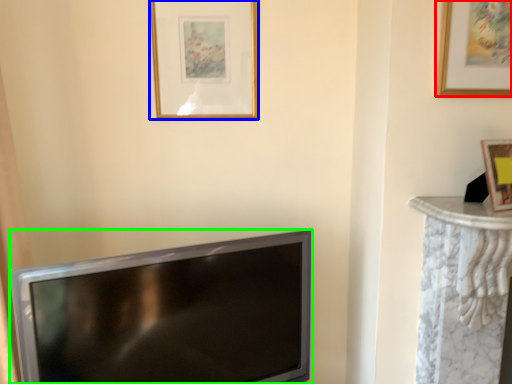
Question: Based on their relative distances, which object is nearer to picture frame (highlighted by a red box)? Choose from picture frame (highlighted by a blue box) and television (highlighted by a green box).

Choices:
 (A) picture frame
 (B) television

Answer: (A)